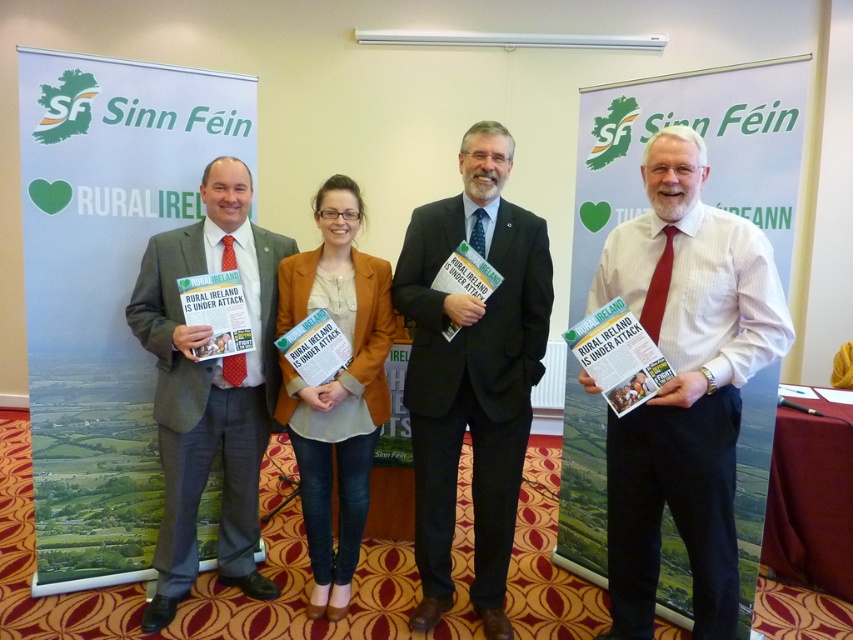
Question: Based on their relative distances, which object is nearer to the matte brown blazer at center?

Choices:
 (A) dark blue suit at center
 (B) matte gray suit at center
 (C) white striped shirt at center

Answer: (B)

Question: Estimate the real-world distances between objects in this image. Which object is farther from the white striped shirt at center?

Choices:
 (A) dark blue suit at center
 (B) matte brown blazer at center

Answer: (B)

Question: From the image, what is the correct spatial relationship of white striped shirt at center in relation to matte brown blazer at center?

Choices:
 (A) left
 (B) right

Answer: (B)

Question: Is white striped shirt at center to the right of dark blue suit at center from the viewer's perspective?

Choices:
 (A) yes
 (B) no

Answer: (A)

Question: Which object is the farthest from the matte gray suit at center?

Choices:
 (A) white striped shirt at center
 (B) matte brown blazer at center
 (C) dark blue suit at center

Answer: (A)

Question: Does white striped shirt at center have a lesser width compared to matte gray suit at center?

Choices:
 (A) no
 (B) yes

Answer: (A)